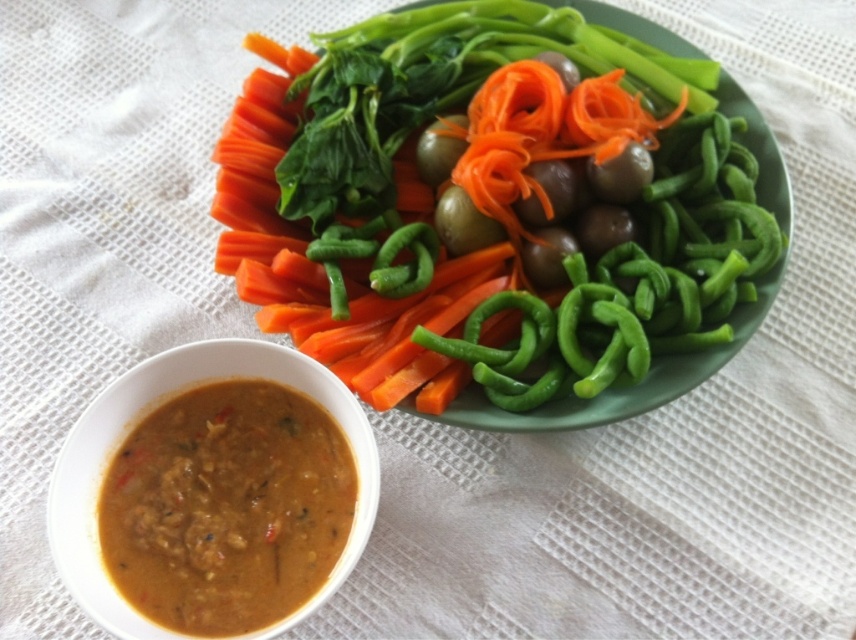
Question: Can you confirm if green glossy bell pepper at upper center is thinner than brown creamy soup at lower left?

Choices:
 (A) no
 (B) yes

Answer: (A)

Question: Can you confirm if green glossy bell pepper at upper center is positioned to the right of orange smooth carrot at center?

Choices:
 (A) yes
 (B) no

Answer: (A)

Question: Which of these objects is positioned farthest from the green glossy bell pepper at upper center?

Choices:
 (A) brown creamy soup at lower left
 (B) orange smooth carrot at center

Answer: (A)

Question: Considering the real-world distances, which object is closest to the brown creamy soup at lower left?

Choices:
 (A) green glossy bell pepper at upper center
 (B) orange smooth carrot at center

Answer: (B)

Question: Which of the following is the farthest from the observer?

Choices:
 (A) coord(605,371)
 (B) coord(254,392)

Answer: (A)

Question: From the image, what is the correct spatial relationship of green glossy bell pepper at upper center in relation to brown creamy soup at lower left?

Choices:
 (A) right
 (B) left

Answer: (A)